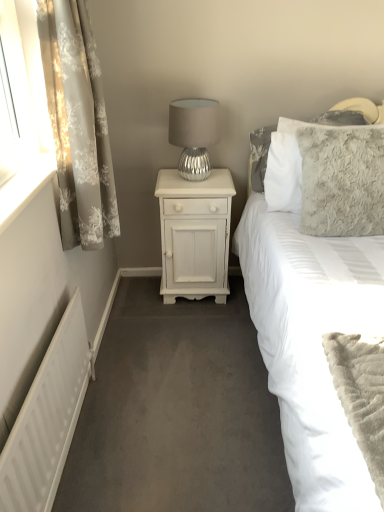
What are the coordinates of `free space in front of white painted wood nightstand at center` in the screenshot? It's located at (189, 328).